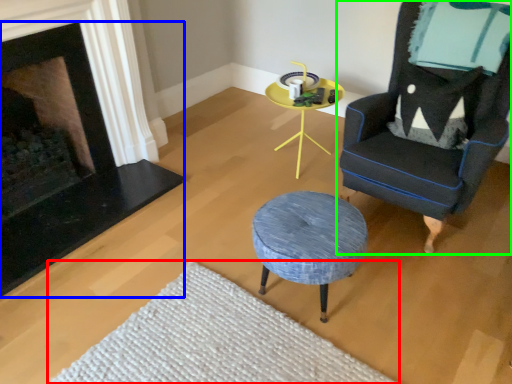
Question: Based on their relative distances, which object is farther from plain (highlighted by a red box)? Choose from fireplace (highlighted by a blue box) and chair (highlighted by a green box).

Choices:
 (A) fireplace
 (B) chair

Answer: (B)